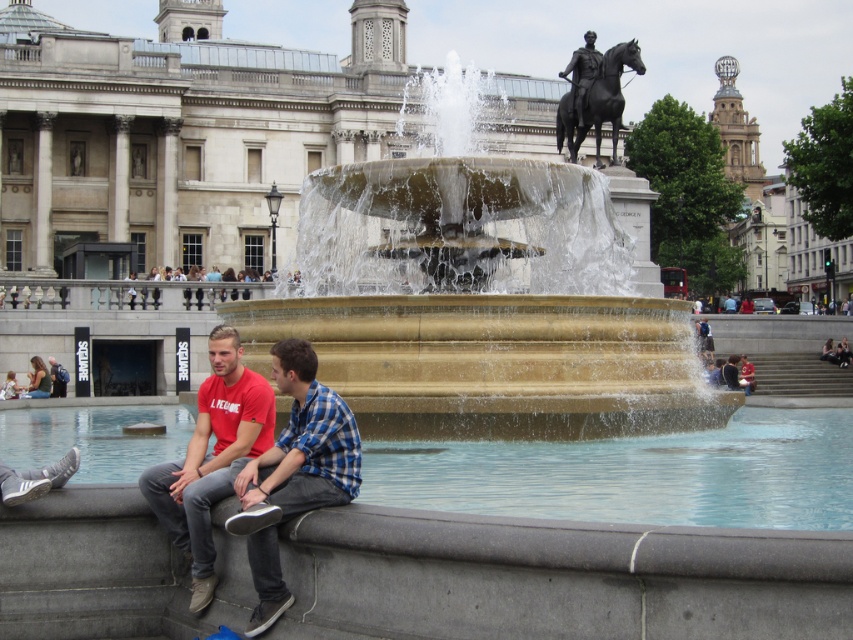
From the picture: You are standing at the entrance of Trafalgar Square and notice the red cotton shirt at lower left and the polished bronze horse at upper center. Which object is closer to the ground?

The red cotton shirt at lower left is positioned under the polished bronze horse at upper center, so it is closer to the ground.

You are a tourist standing in front of the fountain in Trafalgar Square. You see the polished bronze horse at upper center and the polished bronze statue at upper center. Which one is positioned higher on the fountain?

The polished bronze horse at upper center is positioned higher than the polished bronze statue at upper center because it is located above it on the fountain.